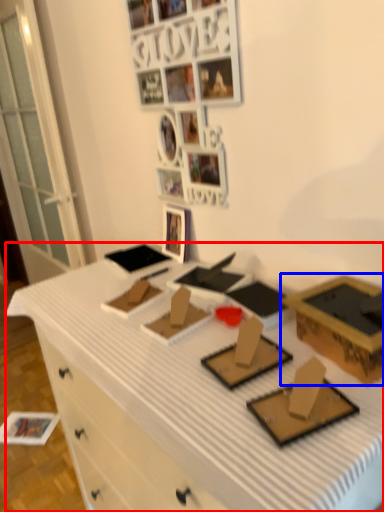
Question: Which object appears farthest to the camera in this image, desk (highlighted by a red box) or box (highlighted by a blue box)?

Choices:
 (A) desk
 (B) box

Answer: (B)